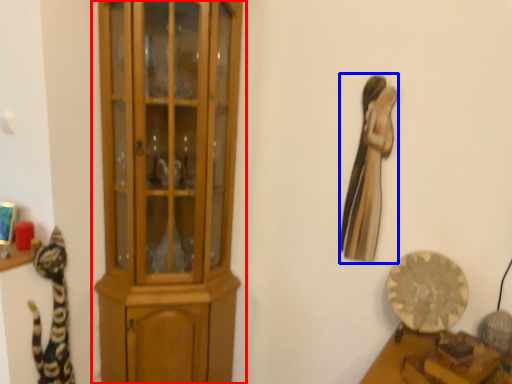
Question: Which object is closer to the camera taking this photo, cupboard (highlighted by a red box) or animal (highlighted by a blue box)?

Choices:
 (A) cupboard
 (B) animal

Answer: (A)